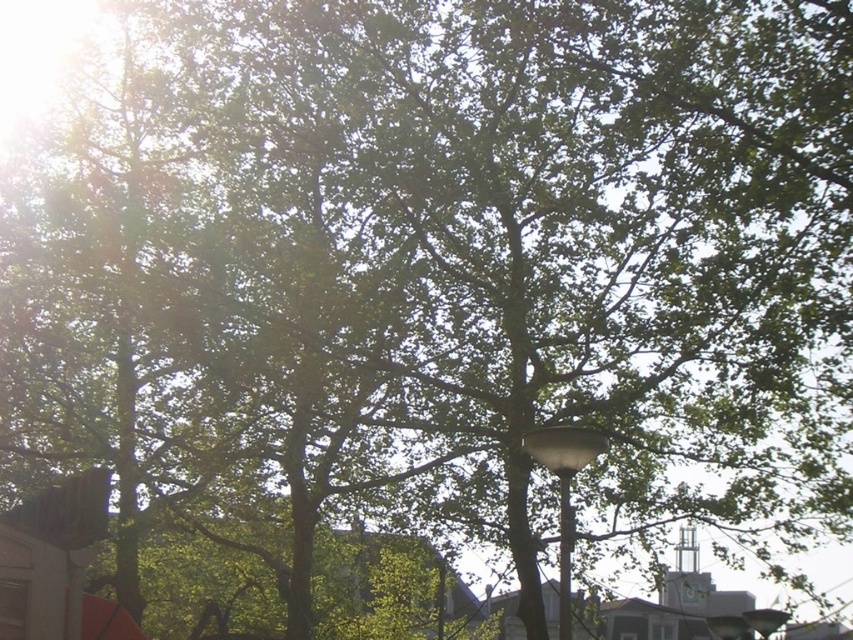
You are standing in a park and see the green leafy tree at center and the white glossy lamp post at center. Which object is positioned lower in the scene?

The green leafy tree at center is located below the white glossy lamp post at center, so it is positioned lower in the scene.

You are standing in a park and see the green leafy tree at center and the white glossy lamp post at center. Which object is closer to your left side?

The green leafy tree at center is to the left of the white glossy lamp post at center, so it is closer to your left side.

You are standing in a park and see a green leafy tree at center. A point labeled as point (387, 589) is marked in the image. Can you determine if this point corresponds to the green leafy tree at center?

The green leafy tree at center is represented by point (387, 589), so yes, the point corresponds to the green leafy tree at center.